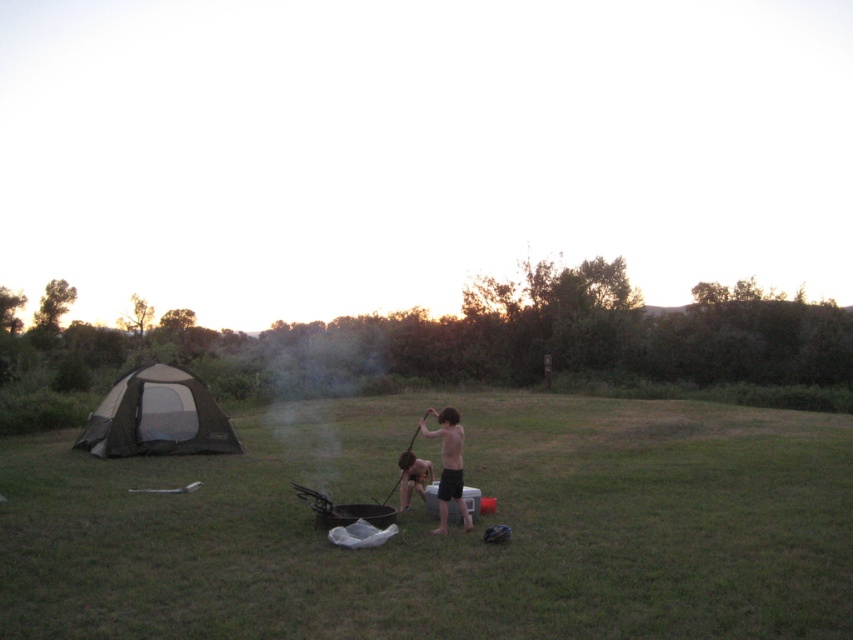
You are planning to set up a campsite in this area. The black mesh tent at left is located at coordinates 0.652, 0.185. If you want to place a new tent 10 meters away from it in the direction of the trees, where should you place the new tent?

The new tent should be placed 10 meters away from the black mesh tent at left in the direction of the trees.

You are a camper who just arrived at the campsite. You see the black matte grill at center and the black mesh tent at left. Which object is closer to you?

The black matte grill at center is closer to you because it is positioned in front of the black mesh tent at left.

You are planning to set up a campfire in the center of the grassy field. However, there is a black matte grill at center and shiny black shorts at center in the way. Which object must you move first to clear the space?

The black matte grill at center is bigger than shiny black shorts at center, so you must move the black matte grill at center first to clear the space.